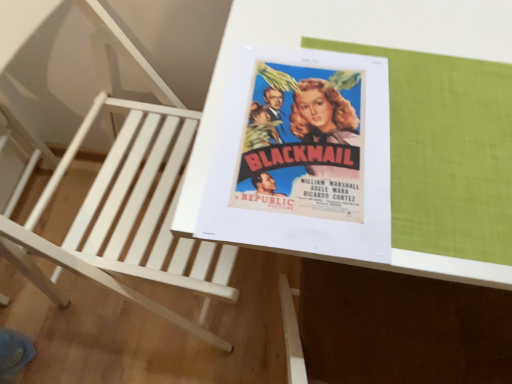
Locate an element on the screen. This screenshot has width=512, height=384. matte paper poster at center is located at coordinates (303, 156).

Consider the image. Is white glossy table at center turned away from matte paper poster at center?

No, white glossy table at center is not facing the opposite direction of matte paper poster at center.

Which object is positioned more to the left, white glossy table at center or matte paper poster at center?

Positioned to the left is matte paper poster at center.

From the image's perspective, does white glossy table at center appear lower than matte paper poster at center?

Yes.

In the image, is matte paper poster at center on the left side or the right side of white wood chair at upper left?

matte paper poster at center is to the right of white wood chair at upper left.

Are matte paper poster at center and white wood chair at upper left making contact?

No, matte paper poster at center is not beside white wood chair at upper left.

Is matte paper poster at center bigger than white wood chair at upper left?

No, matte paper poster at center is not bigger than white wood chair at upper left.

In terms of size, does matte paper poster at center appear bigger or smaller than white glossy table at center?

Considering their sizes, matte paper poster at center takes up less space than white glossy table at center.

From the image's perspective, which one is positioned lower, matte paper poster at center or white glossy table at center?

white glossy table at center is shown below in the image.

Is point (383, 209) less distant than point (454, 9)?

Yes, point (383, 209) is closer to viewer.

The image size is (512, 384). Find the location of `paperback book above the white glossy table at center (from a real-world perspective)`. paperback book above the white glossy table at center (from a real-world perspective) is located at coordinates (303, 156).

Does white wood chair at upper left appear on the left side of white glossy table at center?

Yes.

You are a GUI agent. You are given a task and a screenshot of the screen. Output one action in this format:
    pyautogui.click(x=<x>, y=<y>)
    Task: Click on the table located on the right of white wood chair at upper left
    The height and width of the screenshot is (384, 512).
    Given the screenshot: What is the action you would take?
    pyautogui.click(x=343, y=40)

Can you confirm if white wood chair at upper left is taller than white glossy table at center?

Indeed, white wood chair at upper left has a greater height compared to white glossy table at center.

From a real-world perspective, between white glossy table at center and white wood chair at upper left, who is vertically higher?

In real-world perspective, white glossy table at center is above.

From the picture: Which of these two, white glossy table at center or white wood chair at upper left, stands taller?

white wood chair at upper left is taller.

Is point (325, 10) closer or farther from the camera than point (118, 262)?

Point (325, 10) is positioned closer to the camera compared to point (118, 262).

From the image's perspective, is white glossy table at center located above or below white wood chair at upper left?

Based on their image positions, white glossy table at center is located above white wood chair at upper left.

Is white wood chair at upper left not near matte paper poster at center?

No, white wood chair at upper left is in close proximity to matte paper poster at center.

From the image's perspective, which object appears higher, white wood chair at upper left or matte paper poster at center?

From the image's view, matte paper poster at center is above.

Which object is further away from the camera, white wood chair at upper left or matte paper poster at center?

matte paper poster at center.

From a real-world perspective, is white wood chair at upper left over matte paper poster at center?

No.

The height and width of the screenshot is (384, 512). Find the location of `paperback book lying on the left of white glossy table at center`. paperback book lying on the left of white glossy table at center is located at coordinates (303, 156).

At what (x,y) coordinates should I click in order to perform the action: click on paperback book on the right of white wood chair at upper left. Please return your answer as a coordinate pair (x, y). Looking at the image, I should click on (303, 156).

Which object lies further to the anchor point matte paper poster at center, white wood chair at upper left or white glossy table at center?

The object further to matte paper poster at center is white wood chair at upper left.

Looking at the image, which one is located further to white wood chair at upper left, white glossy table at center or matte paper poster at center?

matte paper poster at center.

From the image, which object appears to be nearer to matte paper poster at center, white glossy table at center or white wood chair at upper left?

white glossy table at center.

From the image, which object appears to be nearer to white wood chair at upper left, matte paper poster at center or white glossy table at center?

white glossy table at center is positioned closer to the anchor white wood chair at upper left.

When comparing their distances from white glossy table at center, does white wood chair at upper left or matte paper poster at center seem closer?

Among the two, matte paper poster at center is located nearer to white glossy table at center.

Which object lies nearer to the anchor point white glossy table at center, matte paper poster at center or white wood chair at upper left?

matte paper poster at center.

At what (x,y) coordinates should I click in order to perform the action: click on paperback book between white wood chair at upper left and white glossy table at center in the horizontal direction. Please return your answer as a coordinate pair (x, y). This screenshot has width=512, height=384. Looking at the image, I should click on (303, 156).